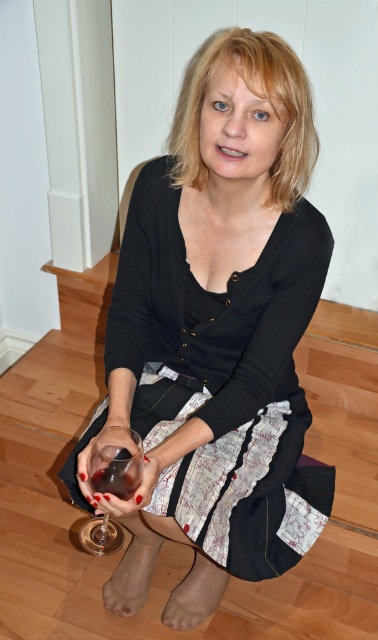
Looking at this image, you are a bartender preparing drinks and need to choose between the transparent glass at lower center and the translucent glass at lower left. Which glass has a larger width?

The transparent glass at lower center has a larger width than the translucent glass at lower left according to the description.

You are organizing a charity event and need to place a 1.2 meter wide banner between the matte black dress at center and the translucent glass at lower left. Based on their widths, will the banner fit between them?

The matte black dress at center is wider than the translucent glass at lower left. Since the banner is 1.2 meters wide, it may not fit between them if the distance between the two objects is less than 1.2 meters. However, the provided information only states their widths, not the distance between them. Without knowing the actual spacing, it is impossible to determine if the banner will fit.

You are a fashion stylist helping someone choose an outfit. They want to know which item is taller between the matte black dress at center and the transparent glass at lower center. Which one should you recommend?

The matte black dress at center is taller than the transparent glass at lower center, so you should recommend the matte black dress at center.